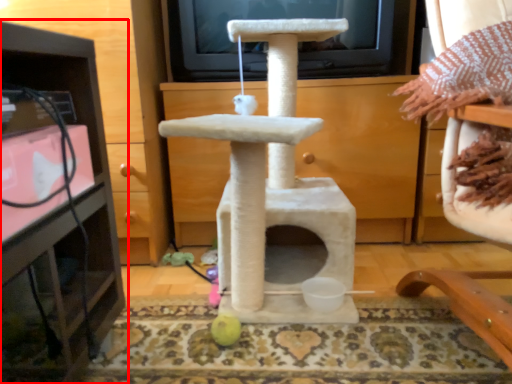
Question: From the image, what is the correct spatial relationship of furniture (annotated by the red box) in relation to furniture?

Choices:
 (A) right
 (B) left

Answer: (B)